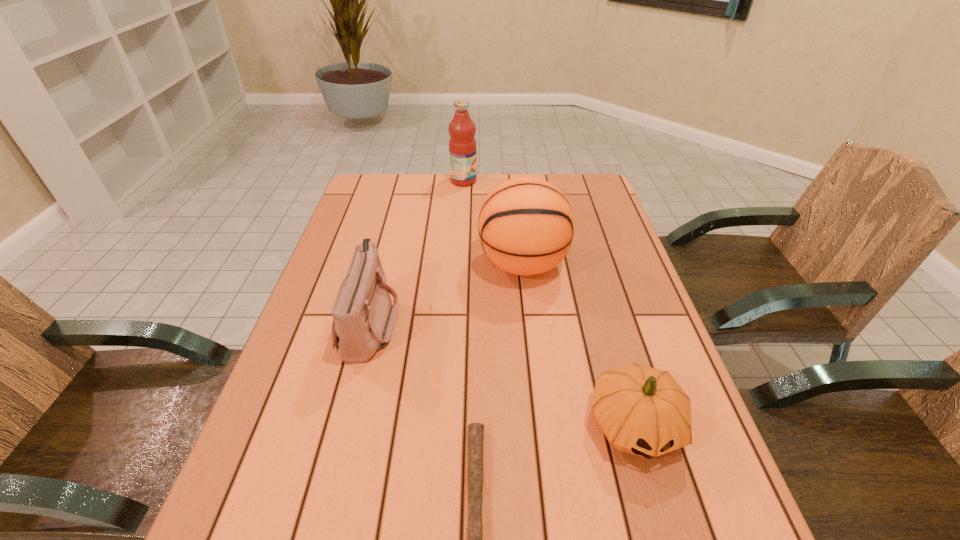
The image size is (960, 540). What are the coordinates of `blank region between the leftmost object and the gourd` in the screenshot? It's located at (502, 374).

Locate an element on the screen. Image resolution: width=960 pixels, height=540 pixels. object that can be found as the closest to the gourd is located at coordinates (475, 430).

Where is `object that is the fourth closest to the farthest object`? object that is the fourth closest to the farthest object is located at coordinates (475, 430).

Locate an element on the screen. This screenshot has width=960, height=540. vacant area in the image that satisfies the following two spatial constraints: 1. on the front label of the fruit juice; 2. on the left side of the basketball is located at coordinates (459, 264).

Locate an element on the screen. The height and width of the screenshot is (540, 960). free space that satisfies the following two spatial constraints: 1. on the front label of the basketball; 2. on the right side of the fruit juice is located at coordinates (459, 264).